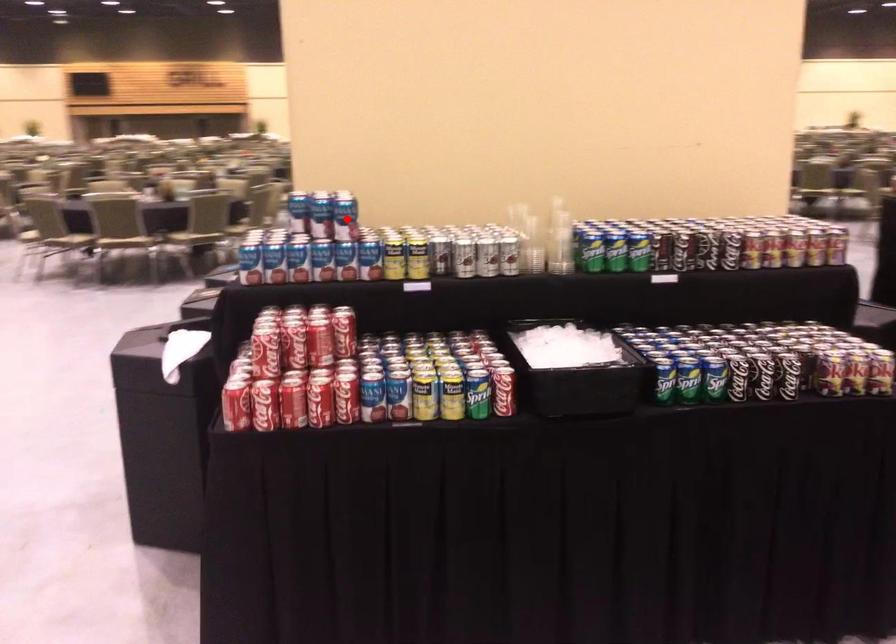
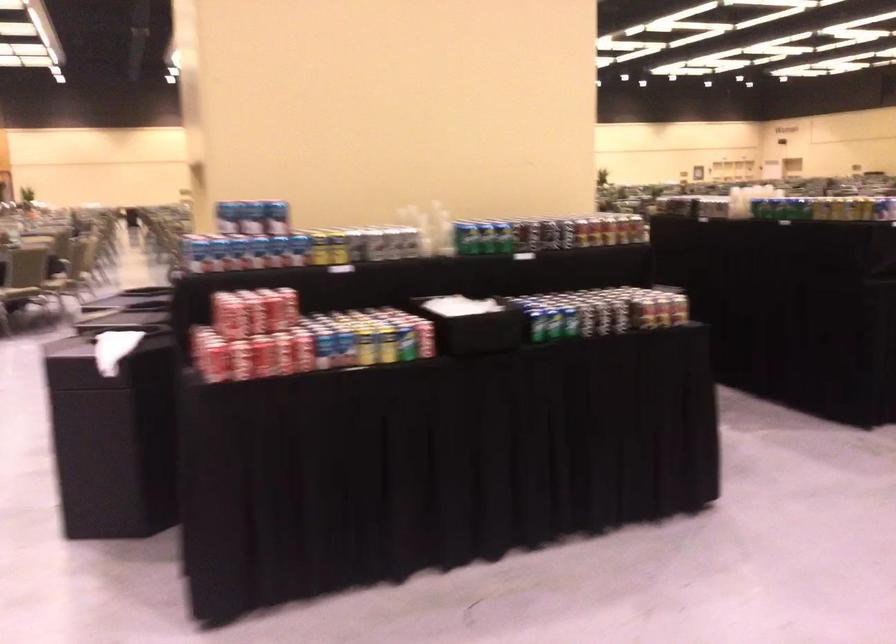
Question: I am providing you with two images of the same scene from different viewpoints. A red point is marked on the first image. Is the red point's position out of view in image 2?

Choices:
 (A) Yes
 (B) No

Answer: (B)